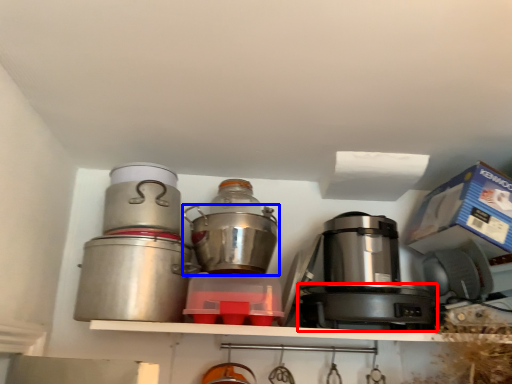
Question: Which object appears farthest to the camera in this image, appliance (highlighted by a red box) or kitchen appliance (highlighted by a blue box)?

Choices:
 (A) appliance
 (B) kitchen appliance

Answer: (B)